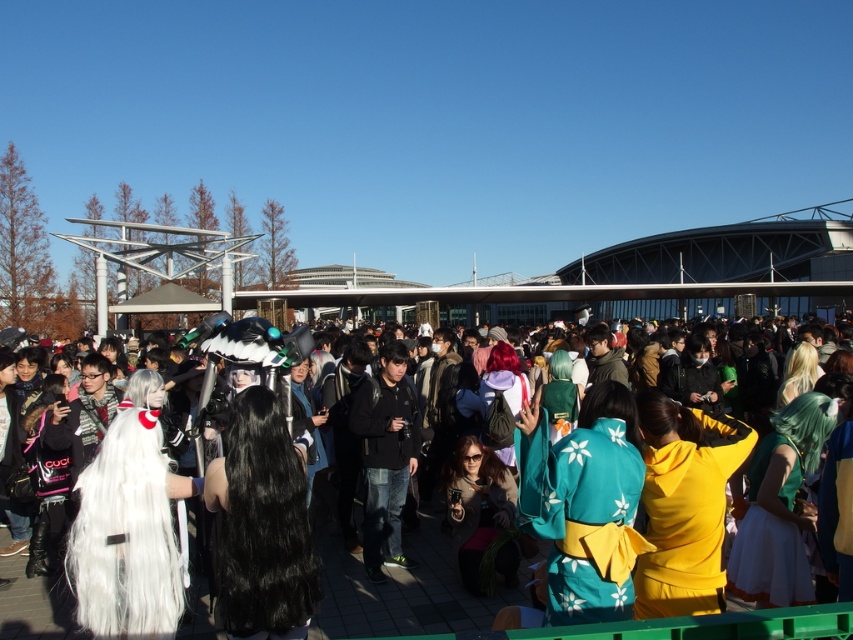
Question: Can you confirm if white fur wig at center is thinner than green satin dress at center?

Choices:
 (A) no
 (B) yes

Answer: (A)

Question: Among these points, which one is nearest to the camera?

Choices:
 (A) (379, 499)
 (B) (656, 477)

Answer: (B)

Question: Which of the following is the farthest from the observer?

Choices:
 (A) white fluffy wig at left
 (B) white fur wig at center
 (C) teal satin kimono at center
 (D) yellow matte hoodie at center

Answer: (D)

Question: Does black silky wig at center come in front of yellow matte hoodie at center?

Choices:
 (A) no
 (B) yes

Answer: (B)

Question: Which point is farther to the camera?

Choices:
 (A) white fur wig at center
 (B) green satin dress at center
 (C) yellow matte hoodie at center

Answer: (C)

Question: Is white fur wig at center above black silky wig at center?

Choices:
 (A) yes
 (B) no

Answer: (B)